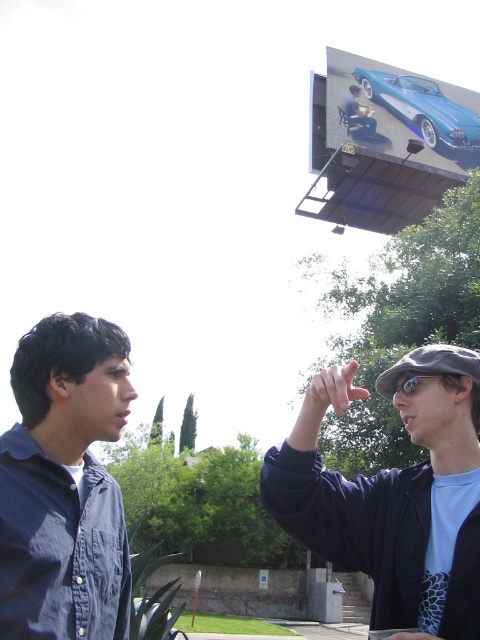
Question: Which of the following is the farthest from the observer?

Choices:
 (A) (x=403, y=548)
 (B) (x=403, y=380)
 (C) (x=121, y=547)
 (D) (x=344, y=99)

Answer: (D)

Question: Is denim shirt at left above clear plastic goggles at upper center?

Choices:
 (A) yes
 (B) no

Answer: (B)

Question: Which of the following is the closest to the observer?

Choices:
 (A) (412, 385)
 (B) (74, 321)
 (C) (350, 131)
 (D) (332, 77)

Answer: (B)

Question: Among these points, which one is farthest from the camera?

Choices:
 (A) (360, 108)
 (B) (355, 124)
 (C) (346, 483)
 (D) (441, 376)

Answer: (A)

Question: From the image, what is the correct spatial relationship of denim shirt at left in relation to clear plastic goggles at upper center?

Choices:
 (A) above
 (B) below

Answer: (B)

Question: Is matte black car at upper center above clear plastic goggles at upper center?

Choices:
 (A) yes
 (B) no

Answer: (A)